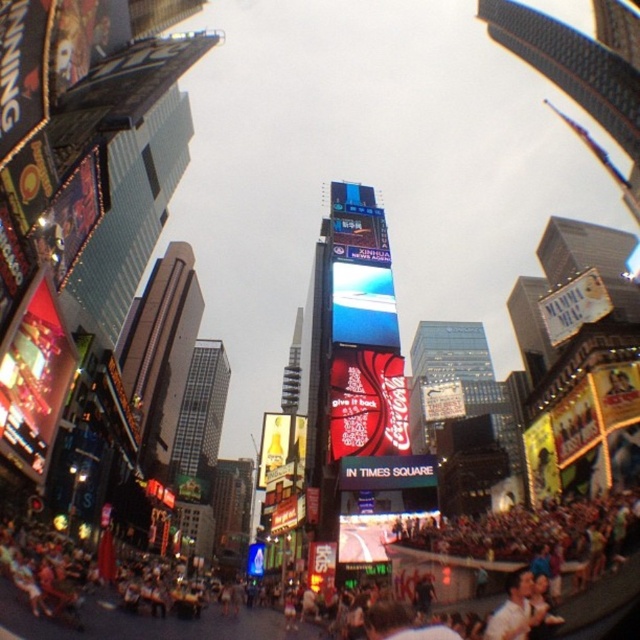
Looking at this image, you are a photographer standing in Times Square with a wide angle lens. You want to take a photo of the light brown hair at lower right while also capturing the human skin textured crowd at lower center. Which object should you position closer to the left side of your frame?

The human skin textured crowd at lower center is to the left of light brown hair at lower right, so to capture both, position the human skin textured crowd at lower center on the left side of your frame and the light brown hair at lower right on the right side.

You are a photographer standing in Times Square and want to capture both the point at coordinates point (33, 577) and the point at coordinates point (525, 588) in your photo. Given the fisheye lens distortion, which point will appear closer to the center of the image?

Point (33, 577) is further to the camera than point (525, 588). Due to the fisheye lens distortion, objects closer to the camera are pulled towards the center of the image. Therefore, the point at coordinates point (33, 577) will appear closer to the center of the image.